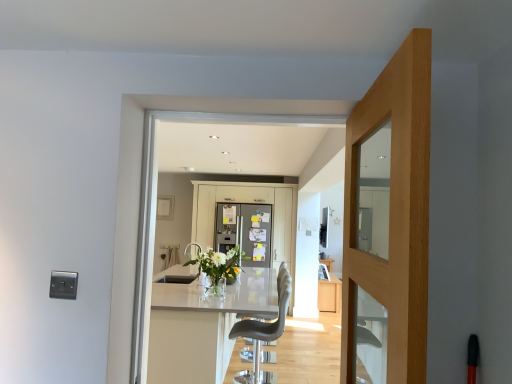
Question: Should I look upward or downward to see clear glass vase at center?

Choices:
 (A) down
 (B) up

Answer: (A)

Question: Is light oak door at center outside matte gray bar stool at center?

Choices:
 (A) no
 (B) yes

Answer: (B)

Question: Considering the relative sizes of light oak door at center and matte gray bar stool at center in the image provided, is light oak door at center thinner than matte gray bar stool at center?

Choices:
 (A) no
 (B) yes

Answer: (B)

Question: Does light oak door at center contain matte gray bar stool at center?

Choices:
 (A) no
 (B) yes

Answer: (A)

Question: From the image's perspective, is light oak door at center on top of matte gray bar stool at center?

Choices:
 (A) no
 (B) yes

Answer: (B)

Question: Are light oak door at center and matte gray bar stool at center located far from each other?

Choices:
 (A) yes
 (B) no

Answer: (A)

Question: Considering the relative positions of light oak door at center and matte gray bar stool at center in the image provided, is light oak door at center to the right of matte gray bar stool at center from the viewer's perspective?

Choices:
 (A) yes
 (B) no

Answer: (A)

Question: Can you confirm if white glossy table at center is positioned to the right of satin white refrigerator at center?

Choices:
 (A) yes
 (B) no

Answer: (B)

Question: Is white glossy table at center bigger than satin white refrigerator at center?

Choices:
 (A) no
 (B) yes

Answer: (B)

Question: Is white glossy table at center oriented towards satin white refrigerator at center?

Choices:
 (A) yes
 (B) no

Answer: (B)

Question: Is white glossy table at center closer to camera compared to satin white refrigerator at center?

Choices:
 (A) yes
 (B) no

Answer: (A)

Question: Does white glossy table at center appear on the left side of satin white refrigerator at center?

Choices:
 (A) yes
 (B) no

Answer: (A)

Question: Is white glossy table at center taller than satin white refrigerator at center?

Choices:
 (A) no
 (B) yes

Answer: (A)

Question: Does clear glass vase at center lie behind matte white cabinet at center?

Choices:
 (A) no
 (B) yes

Answer: (A)